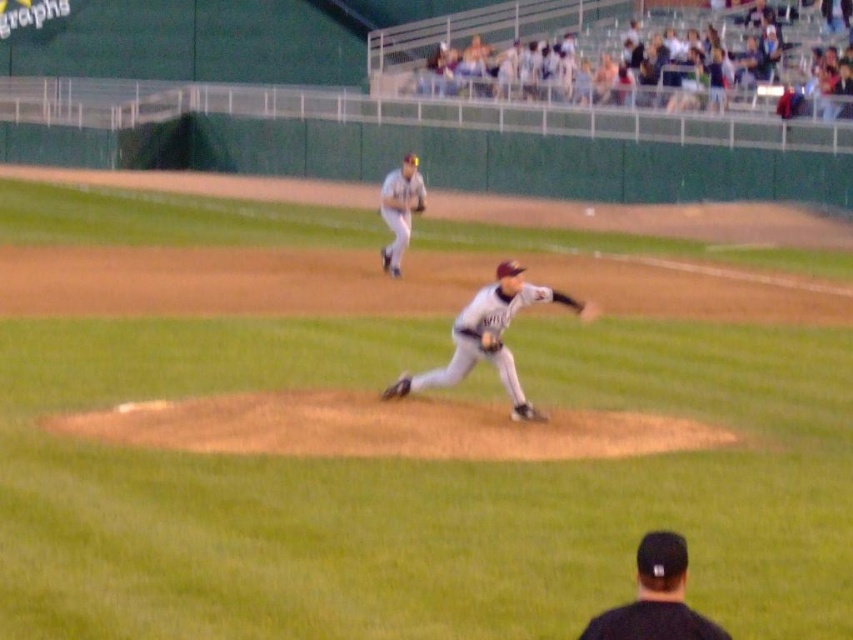
Question: Which of these objects is positioned closest to the dark gray leather glove at center?

Choices:
 (A) black fabric cap at lower center
 (B) gray matte uniform at center
 (C) dark brown leather glove at center

Answer: (B)

Question: Considering the relative positions of gray matte uniform at center and white uniform at upper center in the image provided, where is gray matte uniform at center located with respect to white uniform at upper center?

Choices:
 (A) below
 (B) above

Answer: (A)

Question: Which object is farther from the camera taking this photo?

Choices:
 (A) gray matte uniform at center
 (B) dark gray leather glove at center
 (C) white uniform at upper center
 (D) black fabric cap at lower center

Answer: (B)

Question: Can you confirm if gray matte uniform at center is positioned to the left of white uniform at upper center?

Choices:
 (A) yes
 (B) no

Answer: (B)

Question: In this image, where is black fabric cap at lower center located relative to dark brown leather glove at center?

Choices:
 (A) right
 (B) left

Answer: (A)

Question: Among these objects, which one is farthest from the camera?

Choices:
 (A) gray matte uniform at center
 (B) dark gray leather glove at center

Answer: (B)